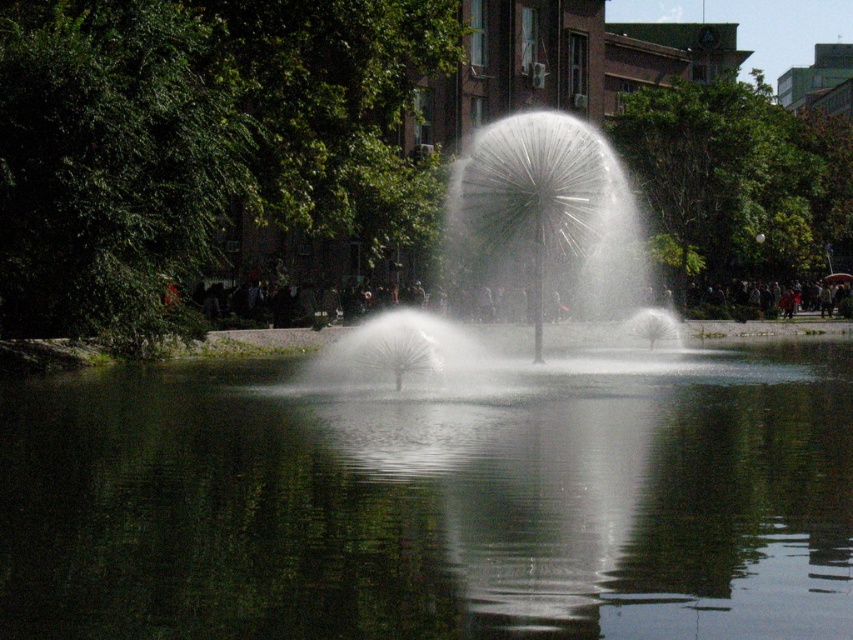
Question: Which point appears closest to the camera in this image?

Choices:
 (A) (413, 374)
 (B) (299, 512)

Answer: (B)

Question: Can you confirm if transparent liquid water at center is bigger than white frothy water at center?

Choices:
 (A) no
 (B) yes

Answer: (A)

Question: Does transparent liquid water at center have a greater width compared to white frothy water at center?

Choices:
 (A) no
 (B) yes

Answer: (B)

Question: Does transparent liquid water at center come in front of white frothy water at center?

Choices:
 (A) yes
 (B) no

Answer: (A)